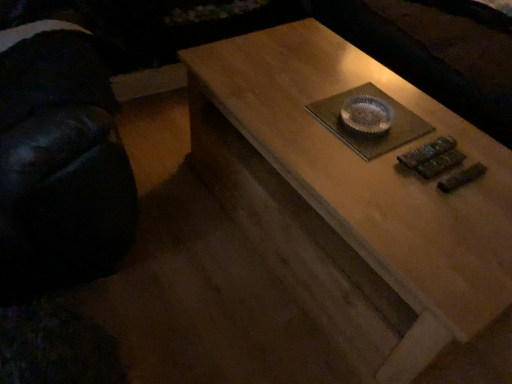
Locate an element on the screen. The height and width of the screenshot is (384, 512). black fabric swivel chair at left is located at coordinates (60, 150).

The height and width of the screenshot is (384, 512). What do you see at coordinates (60, 150) in the screenshot?
I see `black fabric swivel chair at left` at bounding box center [60, 150].

Find the location of `wooden coffee table at center`. wooden coffee table at center is located at coordinates (351, 200).

What is the approximate width of wooden coffee table at center?

The width of wooden coffee table at center is 4.00 feet.

Describe the element at coordinates (351, 200) in the screenshot. I see `wooden coffee table at center` at that location.

In order to click on black fabric swivel chair at left in this screenshot , I will do `click(60, 150)`.

Which is more to the left, black fabric swivel chair at left or wooden coffee table at center?

Positioned to the left is black fabric swivel chair at left.

Which object is further away from the camera, black fabric swivel chair at left or wooden coffee table at center?

wooden coffee table at center is more distant.

Is point (89, 277) behind point (335, 82)?

That is False.

From the image's perspective, would you say black fabric swivel chair at left is positioned over wooden coffee table at center?

Yes, from the image's perspective, black fabric swivel chair at left is above wooden coffee table at center.

From a real-world perspective, is black fabric swivel chair at left positioned under wooden coffee table at center based on gravity?

No, from a real-world perspective, black fabric swivel chair at left is not beneath wooden coffee table at center.

Considering the sizes of objects black fabric swivel chair at left and wooden coffee table at center in the image provided, who is thinner, black fabric swivel chair at left or wooden coffee table at center?

black fabric swivel chair at left is thinner.

Between black fabric swivel chair at left and wooden coffee table at center, which one has less height?

wooden coffee table at center.

Considering the sizes of objects black fabric swivel chair at left and wooden coffee table at center in the image provided, who is bigger, black fabric swivel chair at left or wooden coffee table at center?

Bigger between the two is black fabric swivel chair at left.

Is black fabric swivel chair at left positioned beyond the bounds of wooden coffee table at center?

Yes, black fabric swivel chair at left is located beyond the bounds of wooden coffee table at center.

Are black fabric swivel chair at left and wooden coffee table at center located far from each other?

No, black fabric swivel chair at left is not far away from wooden coffee table at center.

Could you tell me if black fabric swivel chair at left is turned towards wooden coffee table at center?

No, black fabric swivel chair at left is not aimed at wooden coffee table at center.

Where is `swivel chair above the wooden coffee table at center (from a real-world perspective)`? This screenshot has width=512, height=384. swivel chair above the wooden coffee table at center (from a real-world perspective) is located at coordinates (60, 150).

Considering the relative positions of wooden coffee table at center and black fabric swivel chair at left in the image provided, is wooden coffee table at center to the left or to the right of black fabric swivel chair at left?

Clearly, wooden coffee table at center is on the right of black fabric swivel chair at left in the image.

Which object is closer to the camera taking this photo, wooden coffee table at center or black fabric swivel chair at left?

Positioned in front is black fabric swivel chair at left.

Is point (341, 169) closer or farther from the camera than point (60, 30)?

Clearly, point (341, 169) is closer to the camera than point (60, 30).

From the image's perspective, is wooden coffee table at center above black fabric swivel chair at left?

No.

Based on the photo, from a real-world perspective, which object stands above the other?

black fabric swivel chair at left is physically above.

Based on the photo, which object is wider, wooden coffee table at center or black fabric swivel chair at left?

wooden coffee table at center is wider.

Does wooden coffee table at center have a lesser height compared to black fabric swivel chair at left?

Indeed, wooden coffee table at center has a lesser height compared to black fabric swivel chair at left.

Is wooden coffee table at center bigger than black fabric swivel chair at left?

Actually, wooden coffee table at center might be smaller than black fabric swivel chair at left.

Do you think wooden coffee table at center is within black fabric swivel chair at left, or outside of it?

wooden coffee table at center is not enclosed by black fabric swivel chair at left.

Is wooden coffee table at center directly adjacent to black fabric swivel chair at left?

wooden coffee table at center and black fabric swivel chair at left are clearly separated.

Does wooden coffee table at center turn towards black fabric swivel chair at left?

No, wooden coffee table at center is not oriented towards black fabric swivel chair at left.

You are a GUI agent. You are given a task and a screenshot of the screen. Output one action in this format:
    pyautogui.click(x=<x>, y=<y>)
    Task: Click on the swivel chair positioned vertically above the wooden coffee table at center (from a real-world perspective)
    Image resolution: width=512 pixels, height=384 pixels.
    Given the screenshot: What is the action you would take?
    pyautogui.click(x=60, y=150)

Find the location of a particular element. coffee table that is below the black fabric swivel chair at left (from the image's perspective) is located at coordinates (351, 200).

I want to click on swivel chair that appears above the wooden coffee table at center (from a real-world perspective), so pyautogui.click(x=60, y=150).